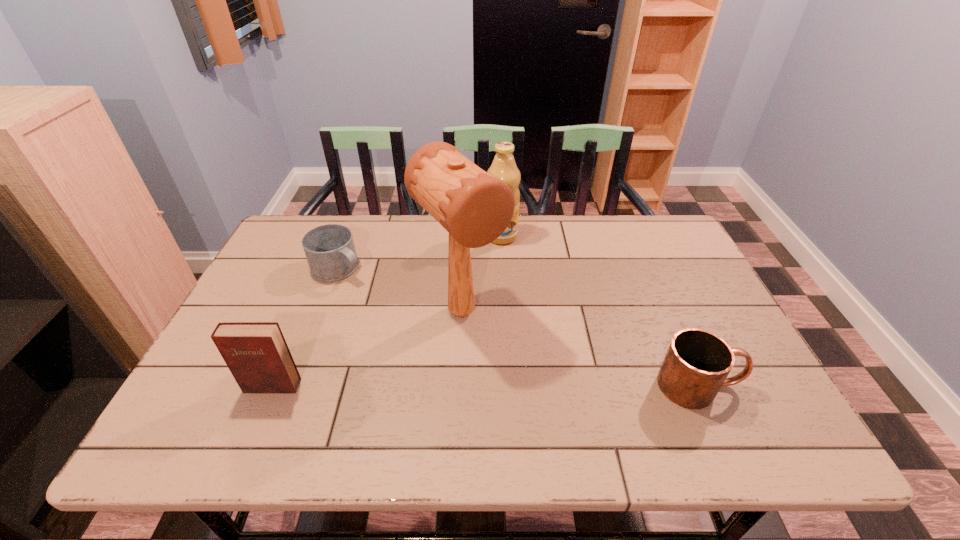
You are a GUI agent. You are given a task and a screenshot of the screen. Output one action in this format:
    pyautogui.click(x=<x>, y=<y>)
    Task: Click on the unoccupied position between the third tallest object and the left mug
    The width and height of the screenshot is (960, 540).
    Given the screenshot: What is the action you would take?
    (305, 327)

Where is `free space between the nearer mug and the farthest object`? free space between the nearer mug and the farthest object is located at coordinates (601, 311).

The image size is (960, 540). Identify the location of the closest object to the farthest object. [x=475, y=208].

Identify which object is located as the second nearest to the fourth shortest object. Please provide its 2D coordinates. Your answer should be formatted as a tuple, i.e. [(x, y)], where the tuple contains the x and y coordinates of a point satisfying the conditions above.

[(330, 251)]

At what (x,y) coordinates should I click in order to perform the action: click on vacant area in the image that satisfies the following two spatial constraints: 1. on the front side of the farthest object; 2. on the side of the nearer mug with the handle. Please return your answer as a coordinate pair (x, y). The image size is (960, 540). Looking at the image, I should click on (511, 386).

Where is `vacant space that satisfies the following two spatial constraints: 1. on the front side of the second tallest object; 2. on the side of the rightmost object with the handle`? vacant space that satisfies the following two spatial constraints: 1. on the front side of the second tallest object; 2. on the side of the rightmost object with the handle is located at coordinates (511, 386).

This screenshot has height=540, width=960. What are the coordinates of `free space that satisfies the following two spatial constraints: 1. on the back side of the farthest object; 2. on the left side of the mallet` in the screenshot? It's located at (466, 236).

Locate an element on the screen. vacant space that satisfies the following two spatial constraints: 1. on the front side of the olive oil; 2. on the side of the rightmost object with the handle is located at coordinates (511, 386).